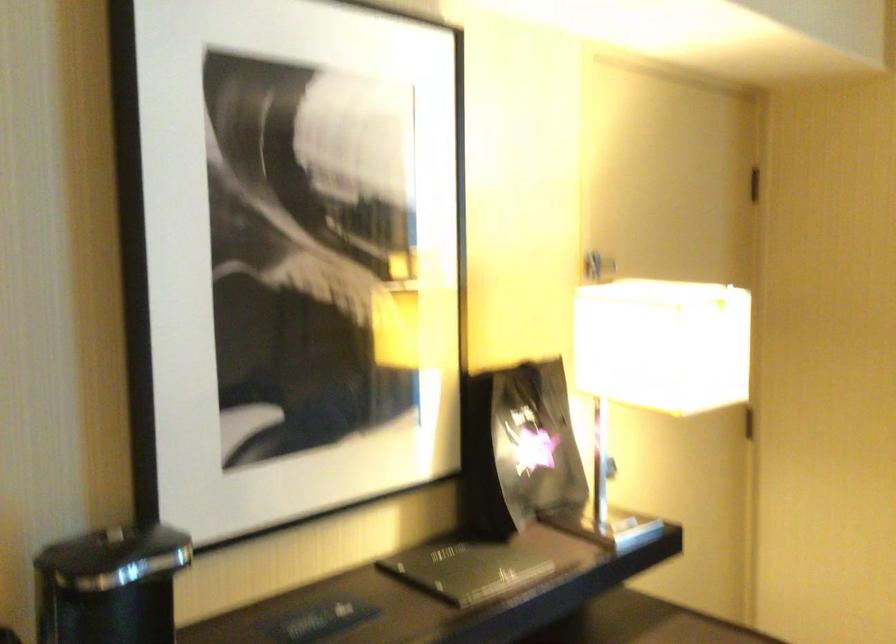
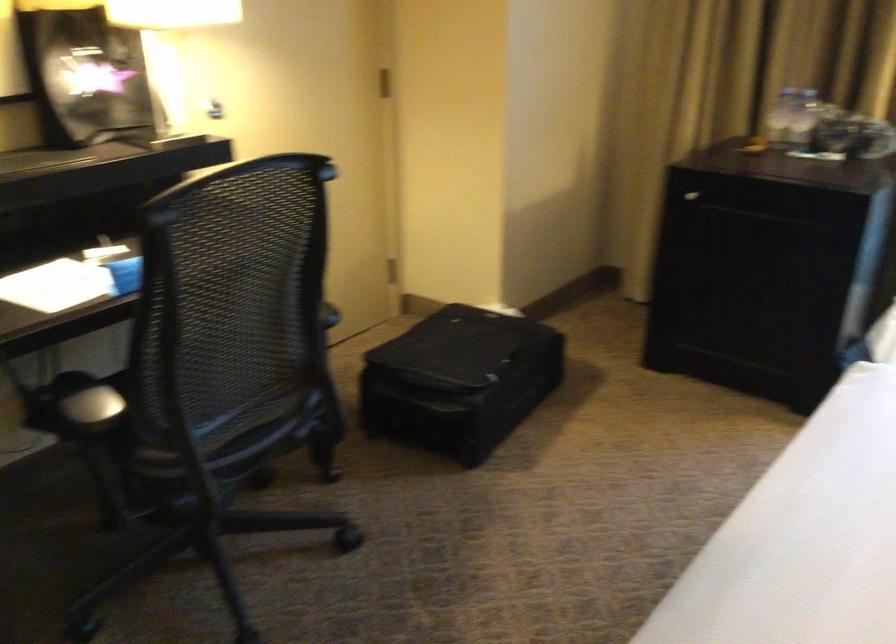
Question: How did the camera likely rotate?

Choices:
 (A) Left
 (B) Right
 (C) Up
 (D) Down

Answer: (D)